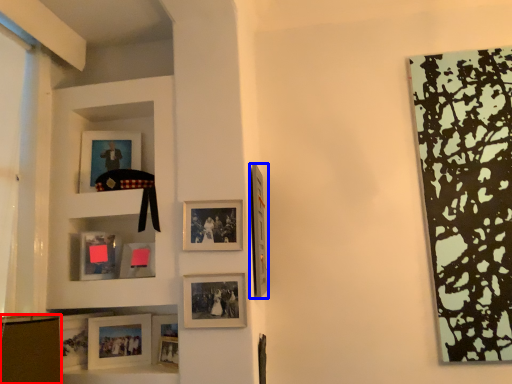
Question: Which of the following is the closest to the observer, shelf (highlighted by a red box) or picture frame (highlighted by a blue box)?

Choices:
 (A) shelf
 (B) picture frame

Answer: (A)